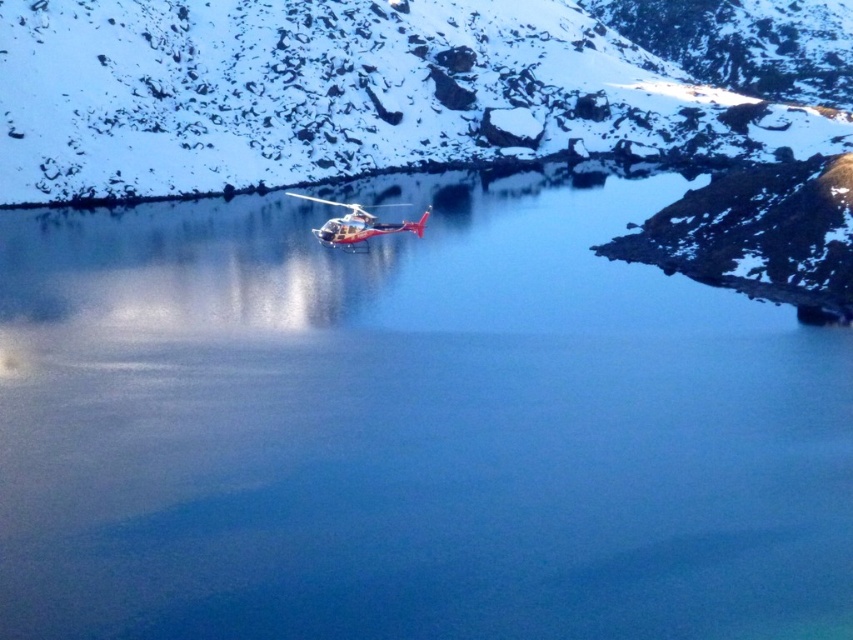
Question: Is matte white mountain at center below metallic silver helicopter at center?

Choices:
 (A) yes
 (B) no

Answer: (B)

Question: Does matte white mountain at center come behind metallic silver helicopter at center?

Choices:
 (A) no
 (B) yes

Answer: (A)

Question: Which point is farther to the camera?

Choices:
 (A) (56, 8)
 (B) (404, 204)

Answer: (A)

Question: Does matte white mountain at center appear under metallic silver helicopter at center?

Choices:
 (A) no
 (B) yes

Answer: (A)

Question: Which point appears farthest from the camera in this image?

Choices:
 (A) (369, 220)
 (B) (439, 54)

Answer: (B)